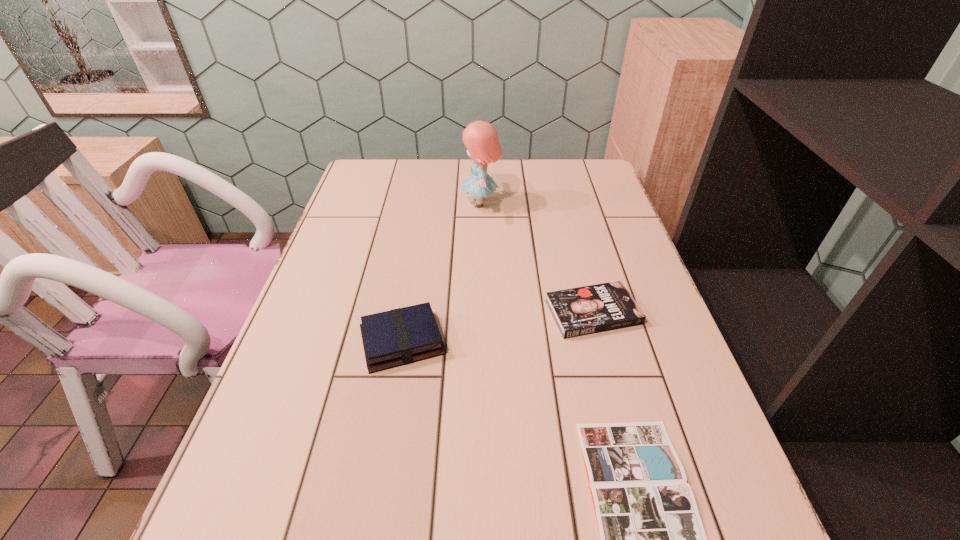
You are a GUI agent. You are given a task and a screenshot of the screen. Output one action in this format:
    pyautogui.click(x=<x>, y=<y>)
    Task: Click on the object that is at the far edge
    
    Given the screenshot: What is the action you would take?
    pyautogui.click(x=481, y=139)

Image resolution: width=960 pixels, height=540 pixels. Identify the location of object positioned at the left edge. (401, 336).

Where is `object positioned at the right edge`? This screenshot has height=540, width=960. object positioned at the right edge is located at coordinates (591, 309).

Locate an element on the screen. Image resolution: width=960 pixels, height=540 pixels. vacant space at the left edge of the desktop is located at coordinates (388, 204).

Find the location of a particular element. This screenshot has width=960, height=540. free space at the right edge of the desktop is located at coordinates (591, 252).

I want to click on vacant region at the far left corner, so click(x=378, y=171).

You are a GUI agent. You are given a task and a screenshot of the screen. Output one action in this format:
    pyautogui.click(x=<x>, y=<y>)
    Task: Click on the vacant region at the far right corner of the desktop
    
    Given the screenshot: What is the action you would take?
    pyautogui.click(x=572, y=167)

This screenshot has height=540, width=960. In order to click on vacant area that lies between the farthest object and the third tallest object in this screenshot , I will do `click(537, 258)`.

This screenshot has height=540, width=960. In order to click on vacant space that is in between the leftmost object and the farthest object in this screenshot , I will do `click(442, 272)`.

Where is `vacant space that is in between the farthest object and the second tallest book`? vacant space that is in between the farthest object and the second tallest book is located at coordinates (537, 258).